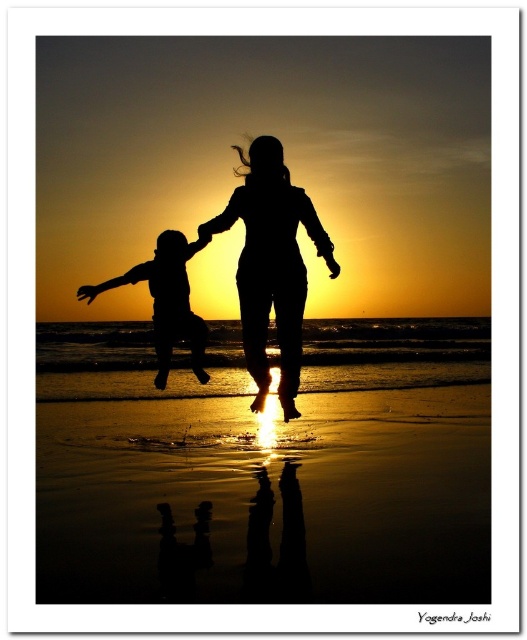
Question: Which is farther from the silhouette figure at center?

Choices:
 (A) matte black figure at left
 (B) shiny sand beach at lower center

Answer: (B)

Question: Does silhouette figure at center appear under matte black figure at left?

Choices:
 (A) yes
 (B) no

Answer: (B)

Question: From the image, what is the correct spatial relationship of shiny sand beach at lower center in relation to silhouette figure at center?

Choices:
 (A) right
 (B) left

Answer: (A)

Question: Which point is closer to the camera taking this photo?

Choices:
 (A) (412, 428)
 (B) (301, 269)
 (C) (154, 276)

Answer: (B)

Question: Which of the following is the closest to the observer?

Choices:
 (A) shiny sand beach at lower center
 (B) matte black figure at left
 (C) silhouette figure at center

Answer: (A)

Question: Is shiny sand beach at lower center smaller than matte black figure at left?

Choices:
 (A) no
 (B) yes

Answer: (A)